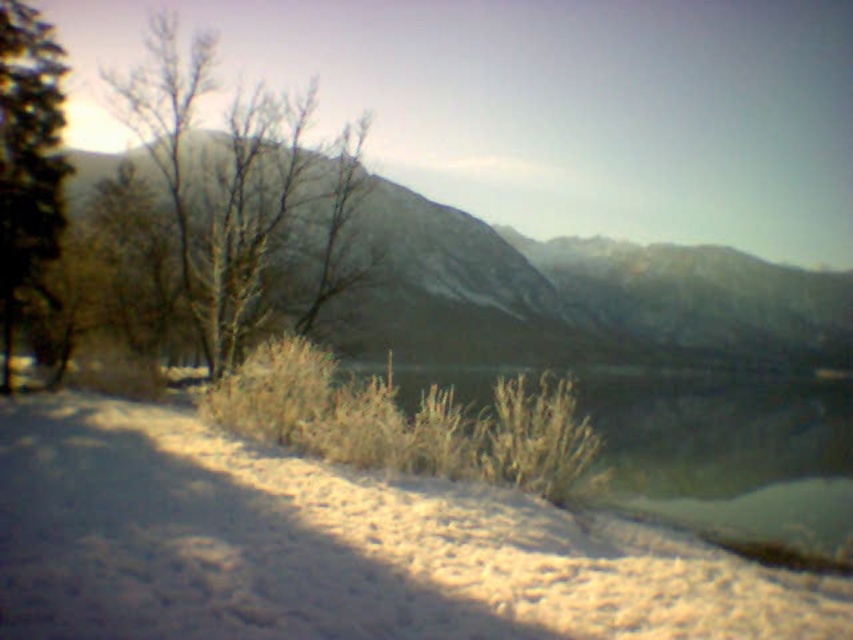
You are standing in the winter landscape and see the clear water at lower center and the green matte tree at left. Which object is located to the east if the image is oriented with north at the top?

The clear water at lower center is to the right of the green matte tree at left. Since the image is oriented with north at the top, right would correspond to the east direction. Therefore, the clear water at lower center is located to the east of the green matte tree at left.

You are an explorer in this winter scene. You need to cross from the mountains in the background to the snow covered ground in the foreground. Which object, the clear water at lower center or the green matte tree at left, would you avoid stepping on if you want to ensure stability?

The clear water at lower center has a larger size compared to the green matte tree at left, so it might be deeper and less stable. The green matte tree at left is smaller and possibly more solid ground. Avoid the clear water at lower center for stability.

Consider the image. You are standing in the winter landscape and see the clear water at lower center and the bare branches at center. Which object is located to the right of the other?

The clear water at lower center is positioned on the right side of bare branches at center.